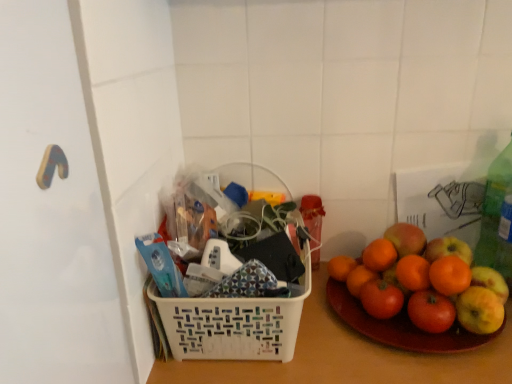
Question: Does green plastic bottle at right have a greater height compared to white plastic basket at center?

Choices:
 (A) yes
 (B) no

Answer: (B)

Question: From the image's perspective, is green plastic bottle at right above white plastic basket at center?

Choices:
 (A) no
 (B) yes

Answer: (B)

Question: Is green plastic bottle at right located outside white plastic basket at center?

Choices:
 (A) no
 (B) yes

Answer: (B)

Question: Considering the relative sizes of green plastic bottle at right and white plastic basket at center in the image provided, is green plastic bottle at right shorter than white plastic basket at center?

Choices:
 (A) yes
 (B) no

Answer: (A)

Question: Can you confirm if green plastic bottle at right is bigger than white plastic basket at center?

Choices:
 (A) no
 (B) yes

Answer: (A)

Question: Considering the positions of green plastic bottle at right and smooth orange grapefruit at right in the image, is green plastic bottle at right bigger or smaller than smooth orange grapefruit at right?

Choices:
 (A) big
 (B) small

Answer: (B)

Question: From the image's perspective, relative to smooth orange grapefruit at right, is green plastic bottle at right above or below?

Choices:
 (A) below
 (B) above

Answer: (B)

Question: Is green plastic bottle at right wider or thinner than smooth orange grapefruit at right?

Choices:
 (A) wide
 (B) thin

Answer: (B)

Question: Relative to smooth orange grapefruit at right, is green plastic bottle at right in front or behind?

Choices:
 (A) behind
 (B) front

Answer: (A)

Question: From a real-world perspective, is white plastic basket at center positioned above or below green plastic bottle at right?

Choices:
 (A) below
 (B) above

Answer: (A)

Question: In terms of height, does white plastic basket at center look taller or shorter compared to green plastic bottle at right?

Choices:
 (A) tall
 (B) short

Answer: (B)

Question: Is point click(x=249, y=319) closer or farther from the camera than point click(x=502, y=264)?

Choices:
 (A) closer
 (B) farther

Answer: (A)

Question: Would you say white plastic basket at center is to the left or to the right of green plastic bottle at right in the picture?

Choices:
 (A) left
 (B) right

Answer: (A)

Question: Is point pyautogui.click(x=320, y=316) positioned closer to the camera than point pyautogui.click(x=394, y=256)?

Choices:
 (A) farther
 (B) closer

Answer: (B)

Question: From a real-world perspective, is white plastic basket at center physically located above or below smooth orange grapefruit at right?

Choices:
 (A) below
 (B) above

Answer: (A)